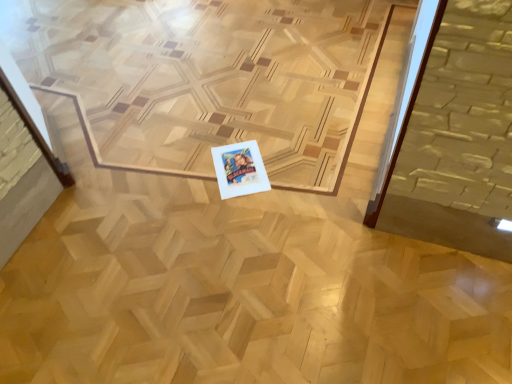
This screenshot has width=512, height=384. Identify the location of natural wood plywood at center. (241, 294).

In order to face natural wood plywood at center, should I rotate leftwards or rightwards?

You should rotate left by 11.083 degrees.

The height and width of the screenshot is (384, 512). Describe the element at coordinates (241, 294) in the screenshot. I see `natural wood plywood at center` at that location.

What is the approximate height of white paper at center?

white paper at center is 0.86 inches in height.

Looking at this image, in order to face white paper at center, should I rotate leftwards or rightwards?

To face it directly, rotate left by 2.176 degrees.

Identify the location of white paper at center. The image size is (512, 384). (240, 169).

Measure the distance between white paper at center and camera.

white paper at center and camera are 5.77 feet apart.

The height and width of the screenshot is (384, 512). What do you see at coordinates (240, 169) in the screenshot?
I see `white paper at center` at bounding box center [240, 169].

Identify the location of natural wood plywood at center. This screenshot has width=512, height=384. (241, 294).

Does white paper at center appear on the left side of natural wood plywood at center?

No, white paper at center is not to the left of natural wood plywood at center.

Which object is more forward, white paper at center or natural wood plywood at center?

natural wood plywood at center is in front.

Is point (219, 186) less distant than point (313, 219)?

No, (219, 186) is behind (313, 219).

From the image's perspective, which object appears higher, white paper at center or natural wood plywood at center?

natural wood plywood at center.

From a real-world perspective, does white paper at center sit lower than natural wood plywood at center?

Correct, in the physical world, white paper at center is lower than natural wood plywood at center.

Considering the sizes of objects white paper at center and natural wood plywood at center in the image provided, who is wider, white paper at center or natural wood plywood at center?

With larger width is natural wood plywood at center.

Does white paper at center have a greater height compared to natural wood plywood at center?

No.

Who is smaller, white paper at center or natural wood plywood at center?

With smaller size is white paper at center.

Is natural wood plywood at center located within white paper at center?

No, natural wood plywood at center is located outside of white paper at center.

Would you consider white paper at center to be distant from natural wood plywood at center?

white paper at center is actually quite close to natural wood plywood at center.

Based on the photo, is white paper at center facing towards natural wood plywood at center?

Yes, white paper at center is aimed at natural wood plywood at center.

How much distance is there between white paper at center and natural wood plywood at center?

The distance of white paper at center from natural wood plywood at center is 18.58 inches.

Where is `plywood on the left of white paper at center`? plywood on the left of white paper at center is located at coordinates (241, 294).

Can you confirm if natural wood plywood at center is positioned to the right of white paper at center?

Incorrect, natural wood plywood at center is not on the right side of white paper at center.

Is natural wood plywood at center positioned in front of white paper at center?

Yes, natural wood plywood at center is closer to the camera.

Which is less distant, (49, 314) or (244, 155)?

Clearly, point (49, 314) is closer to the camera than point (244, 155).

From the image's perspective, is natural wood plywood at center on top of white paper at center?

Indeed, from the image's perspective, natural wood plywood at center is shown above white paper at center.

From a real-world perspective, who is located higher, natural wood plywood at center or white paper at center?

From a 3D spatial view, natural wood plywood at center is above.

Considering the relative sizes of natural wood plywood at center and white paper at center in the image provided, is natural wood plywood at center wider than white paper at center?

Yes.

Is natural wood plywood at center shorter than white paper at center?

No, natural wood plywood at center is not shorter than white paper at center.

Considering the sizes of objects natural wood plywood at center and white paper at center in the image provided, who is smaller, natural wood plywood at center or white paper at center?

white paper at center is smaller.

Can we say natural wood plywood at center lies outside white paper at center?

Indeed, natural wood plywood at center is completely outside white paper at center.

Is natural wood plywood at center next to white paper at center?

No.

Is white paper at center at the back of natural wood plywood at center?

That's right, natural wood plywood at center is facing away from white paper at center.

Locate an element on the screen. plywood positioned vertically above the white paper at center (from a real-world perspective) is located at coordinates (241, 294).

The image size is (512, 384). Identify the location of postcard below the natural wood plywood at center (from a real-world perspective). (240, 169).

The height and width of the screenshot is (384, 512). In order to click on plywood above the white paper at center (from a real-world perspective) in this screenshot , I will do `click(241, 294)`.